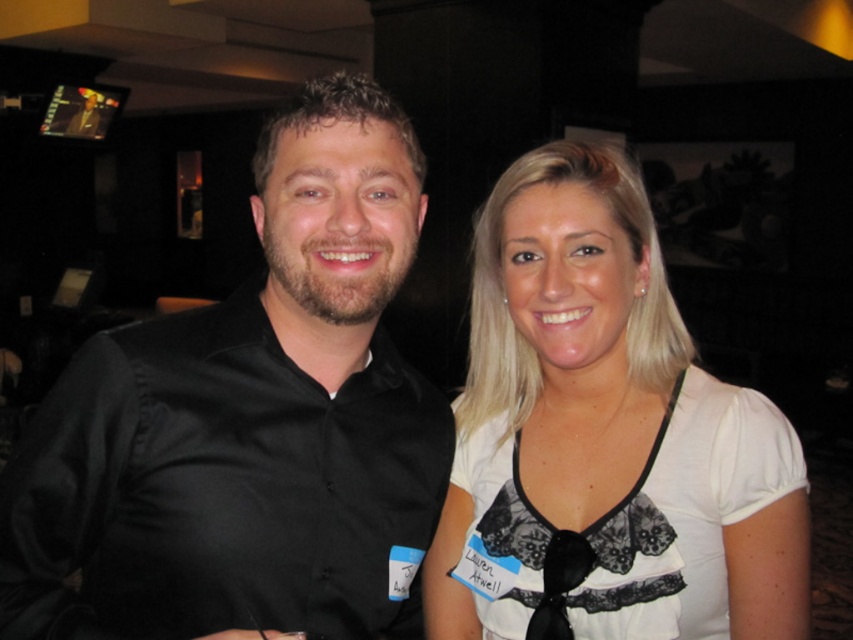
Question: Which object is positioned farthest from the black satin shirt at left?

Choices:
 (A) black satin tie at center
 (B) white lace blouse at center

Answer: (A)

Question: Does black satin shirt at left appear under black satin tie at center?

Choices:
 (A) no
 (B) yes

Answer: (A)

Question: Which object is closer to the camera taking this photo?

Choices:
 (A) white lace blouse at center
 (B) black satin shirt at left

Answer: (B)

Question: Which point is closer to the camera?

Choices:
 (A) white lace blouse at center
 (B) black satin tie at center

Answer: (A)

Question: Can you confirm if white lace blouse at center is positioned above black satin tie at center?

Choices:
 (A) yes
 (B) no

Answer: (A)

Question: Where is black satin shirt at left located in relation to black satin tie at center in the image?

Choices:
 (A) below
 (B) above

Answer: (B)